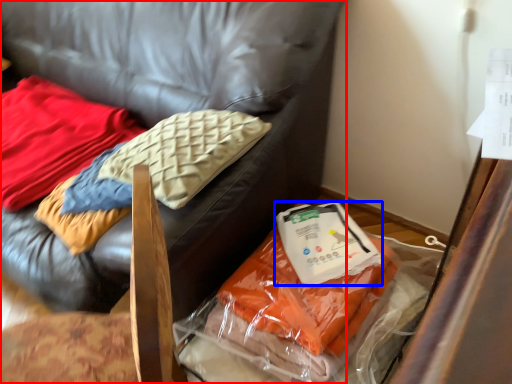
Question: Which of the following is the farthest to the observer, furniture (highlighted by a red box) or kit (highlighted by a blue box)?

Choices:
 (A) furniture
 (B) kit

Answer: (B)